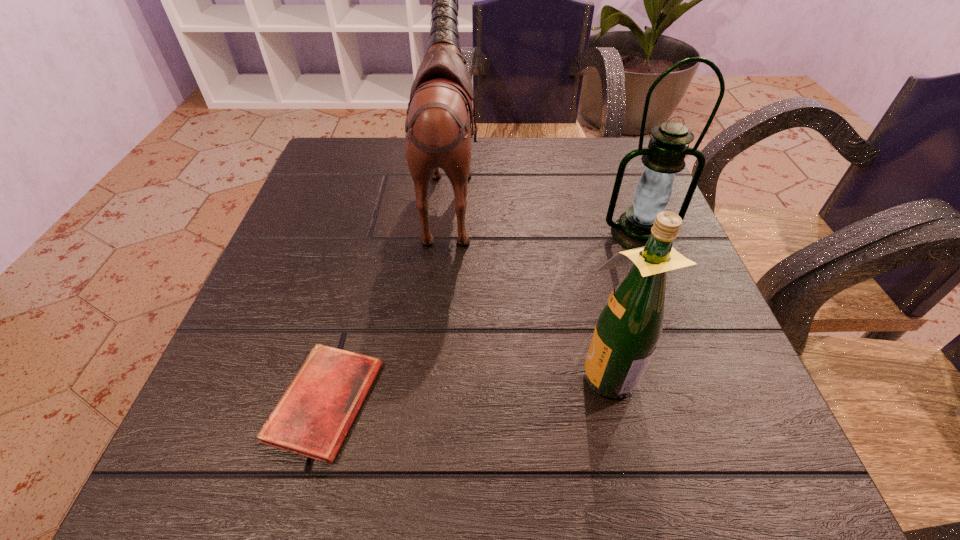
Image resolution: width=960 pixels, height=540 pixels. Identify the location of free space located 0.310m on the back of the diary. (372, 222).

At what (x,y) coordinates should I click in order to perform the action: click on object situated at the far edge. Please return your answer as a coordinate pair (x, y). The width and height of the screenshot is (960, 540). Looking at the image, I should click on (437, 129).

Locate an element on the screen. object located in the near edge section of the desktop is located at coordinates (x=312, y=418).

This screenshot has width=960, height=540. I want to click on object positioned at the left edge, so click(312, 418).

Locate an element on the screen. The height and width of the screenshot is (540, 960). lantern that is at the right edge is located at coordinates (669, 145).

In order to click on liquor at the right edge in this screenshot , I will do `click(630, 324)`.

Find the location of a particular element. The width and height of the screenshot is (960, 540). object present at the near left corner is located at coordinates (312, 418).

The image size is (960, 540). I want to click on free space at the far edge of the desktop, so click(512, 145).

Find the location of a particular element. This screenshot has height=540, width=960. free space at the left edge of the desktop is located at coordinates (325, 213).

The image size is (960, 540). I want to click on vacant space at the right edge, so click(x=702, y=314).